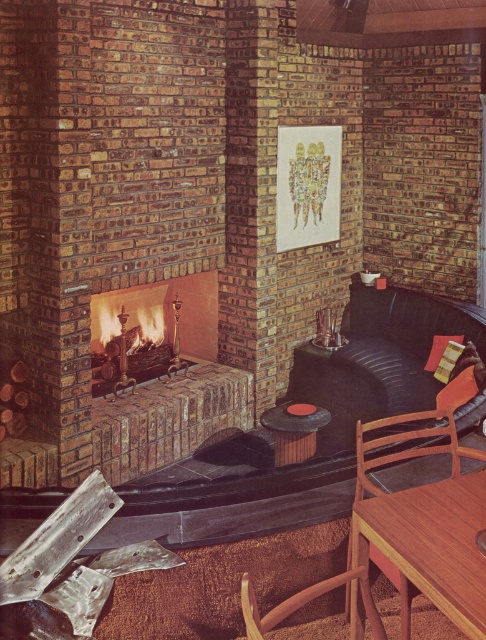
You are standing at the entrance of the room and want to sit on the black leather couch at center. According to the coordinates provided, in which direction should you move relative to the fireplace?

The black leather couch at center is located at coordinates point (380, 358). Since you are facing the fireplace, you should move towards the right side of the room to reach the black leather couch at center.

You are a delivery person carrying a package that requires a clear path to the brick fireplace at center. There is a black leather couch at center in the way. Can you navigate around it without moving the couch?

The black leather couch at center is 1.29 meters away from the brick fireplace at center. Since the distance between them is sufficient, you can navigate around the couch without needing to move it, provided there is enough space on either side or behind the couch to maneuver around it.